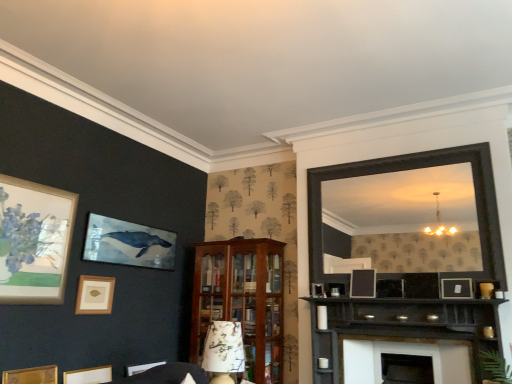
The width and height of the screenshot is (512, 384). What do you see at coordinates (242, 301) in the screenshot?
I see `wooden cabinet at center` at bounding box center [242, 301].

What do you see at coordinates (456, 288) in the screenshot? I see `matte black picture frame at upper right, acting as the first picture frame starting from the right` at bounding box center [456, 288].

What is the approximate width of matte gold picture frame at lower left, the 3th picture frame from the right?

It is 8.76 centimeters.

Where is `matte gold picture frame at lower left, the 2th picture frame in the left-to-right sequence`? This screenshot has width=512, height=384. matte gold picture frame at lower left, the 2th picture frame in the left-to-right sequence is located at coordinates pos(95,295).

The height and width of the screenshot is (384, 512). I want to click on black wooden mirror at upper right, so click(x=407, y=169).

Image resolution: width=512 pixels, height=384 pixels. Identify the location of wooden cabinet at center. (242, 301).

Can you see wooden cabinet at center touching matte gold picture frame at lower left, the 3th picture frame from the right?

No, wooden cabinet at center is not making contact with matte gold picture frame at lower left, the 3th picture frame from the right.

Is wooden cabinet at center at the right side of matte gold picture frame at lower left, the 3th picture frame from the right?

Correct, you'll find wooden cabinet at center to the right of matte gold picture frame at lower left, the 3th picture frame from the right.

Which is closer to the camera, (197, 360) or (73, 375)?

Point (197, 360) appears to be farther away from the viewer than point (73, 375).

From a real-world perspective, who is located lower, wooden cabinet at center or matte gold picture frame at lower left, positioned as the 3th picture frame in left-to-right order?

matte gold picture frame at lower left, positioned as the 3th picture frame in left-to-right order, from a real-world perspective.

Which is behind, point (8, 382) or point (99, 376)?

The point (99, 376) is farther.

Between wooden picture frame at lower left, the fifth picture frame when ordered from right to left, and matte gold picture frame at lower left, positioned as the 3th picture frame in left-to-right order, which one has larger size?

matte gold picture frame at lower left, positioned as the 3th picture frame in left-to-right order.

From the image's perspective, would you say wooden picture frame at lower left, the first picture frame from the left, is positioned over matte gold picture frame at lower left, the 3th picture frame from the right?

Correct, wooden picture frame at lower left, the first picture frame from the left, appears higher than matte gold picture frame at lower left, the 3th picture frame from the right, in the image.

Would you say wooden picture frame at lower left, the fifth picture frame when ordered from right to left, is to the left or to the right of matte gold picture frame at lower left, positioned as the 3th picture frame in left-to-right order, in the picture?

Based on their positions, wooden picture frame at lower left, the fifth picture frame when ordered from right to left, is located to the left of matte gold picture frame at lower left, positioned as the 3th picture frame in left-to-right order.

Is matte gold picture frame at lower left, acting as the 4th picture frame starting from the right, in front of matte gold picture frame at lower left, the 3th picture frame from the right?

No, it is not.

Starting from the matte gold picture frame at lower left, the 3th picture frame from the right, which picture frame is the 1st one to the left? Please provide its 2D coordinates.

[(95, 295)]

How different are the orientations of matte gold picture frame at lower left, acting as the 4th picture frame starting from the right, and matte gold picture frame at lower left, positioned as the 3th picture frame in left-to-right order, in degrees?

The angle between the facing direction of matte gold picture frame at lower left, acting as the 4th picture frame starting from the right, and the facing direction of matte gold picture frame at lower left, positioned as the 3th picture frame in left-to-right order, is 0.309 degrees.

Is matte gold picture frame at lower left, acting as the 4th picture frame starting from the right, oriented towards matte gold picture frame at lower left, positioned as the 3th picture frame in left-to-right order?

No.

Which of these two, matte black picture frame at center, which is counted as the 4th picture frame, starting from the left, or black wooden mirror at upper right, is thinner?

With smaller width is black wooden mirror at upper right.

Which point is more forward, [351,280] or [485,156]?

The point [485,156] is closer to the camera.

Which of these two, matte black picture frame at center, which appears as the second picture frame when viewed from the right, or black wooden mirror at upper right, is bigger?

black wooden mirror at upper right is bigger.

Considering the relative sizes of dark wood shelf at lower right and matte gold picture frame at lower left, the 2th picture frame in the left-to-right sequence, in the image provided, is dark wood shelf at lower right wider than matte gold picture frame at lower left, the 2th picture frame in the left-to-right sequence,?

Yes, dark wood shelf at lower right is wider than matte gold picture frame at lower left, the 2th picture frame in the left-to-right sequence.

Could you tell me if dark wood shelf at lower right is turned towards matte gold picture frame at lower left, the 2th picture frame in the left-to-right sequence?

No, dark wood shelf at lower right is not aimed at matte gold picture frame at lower left, the 2th picture frame in the left-to-right sequence.

Are dark wood shelf at lower right and matte gold picture frame at lower left, acting as the 4th picture frame starting from the right, located far from each other?

Absolutely, dark wood shelf at lower right is distant from matte gold picture frame at lower left, acting as the 4th picture frame starting from the right.

Does matte gold picture frame at lower left, the 3th picture frame from the right, appear on the left side of wooden picture frame at lower left, the fifth picture frame when ordered from right to left?

No, matte gold picture frame at lower left, the 3th picture frame from the right, is not to the left of wooden picture frame at lower left, the fifth picture frame when ordered from right to left.

Does matte gold picture frame at lower left, positioned as the 3th picture frame in left-to-right order, turn towards wooden picture frame at lower left, the first picture frame from the left?

No, matte gold picture frame at lower left, positioned as the 3th picture frame in left-to-right order, is not aimed at wooden picture frame at lower left, the first picture frame from the left.

Considering the points (104, 370) and (41, 380), which point is in front, point (104, 370) or point (41, 380)?

The point (41, 380) is closer.

At what (x,y) coordinates should I click in order to perform the action: click on the 1st picture frame above the matte gold picture frame at lower left, the 3th picture frame from the right (from the image's perspective). Please return your answer as a coordinate pair (x, y). Looking at the image, I should click on (31, 375).

Where is `shelf that appears below the matte black picture frame at center, which is counted as the 4th picture frame, starting from the left (from a real-world perspective)`? shelf that appears below the matte black picture frame at center, which is counted as the 4th picture frame, starting from the left (from a real-world perspective) is located at coordinates (400, 326).

How many degrees apart are the facing directions of dark wood shelf at lower right and matte black picture frame at center, which is counted as the 4th picture frame, starting from the left?

dark wood shelf at lower right and matte black picture frame at center, which is counted as the 4th picture frame, starting from the left, are facing 1.52 degrees away from each other.

Is dark wood shelf at lower right looking in the opposite direction of matte black picture frame at center, which is counted as the 4th picture frame, starting from the left?

dark wood shelf at lower right is not turned away from matte black picture frame at center, which is counted as the 4th picture frame, starting from the left.

Is dark wood shelf at lower right shorter than matte black picture frame at center, which is counted as the 4th picture frame, starting from the left?

No.

This screenshot has height=384, width=512. Find the location of `cabinetry positioned vertically above the matte gold picture frame at lower left, the 3th picture frame from the right (from a real-world perspective)`. cabinetry positioned vertically above the matte gold picture frame at lower left, the 3th picture frame from the right (from a real-world perspective) is located at coordinates (242, 301).

Starting from the wooden picture frame at lower left, the first picture frame from the left, which picture frame is the 1st one behind? Please provide its 2D coordinates.

[(88, 375)]

When comparing their distances from white glossy fireplace at lower center, does matte gold picture frame at lower left, the 2th picture frame in the left-to-right sequence, or wooden cabinet at center seem closer?

The object closer to white glossy fireplace at lower center is wooden cabinet at center.

Which object lies nearer to the anchor point floral-patterned fabric lampshade at center, white glossy fireplace at lower center or matte gold picture frame at lower left, the 2th picture frame in the left-to-right sequence?

matte gold picture frame at lower left, the 2th picture frame in the left-to-right sequence, is closer to floral-patterned fabric lampshade at center.

When comparing their distances from floral-patterned fabric lampshade at center, does black wooden mirror at upper right or matte gold picture frame at lower left, the 2th picture frame in the left-to-right sequence, seem closer?

matte gold picture frame at lower left, the 2th picture frame in the left-to-right sequence, is positioned closer to the anchor floral-patterned fabric lampshade at center.

When comparing their distances from matte gold picture frame at lower left, positioned as the 3th picture frame in left-to-right order, does matte gold picture frame at lower left, the 2th picture frame in the left-to-right sequence, or wooden picture frame at lower left, the fifth picture frame when ordered from right to left, seem closer?

wooden picture frame at lower left, the fifth picture frame when ordered from right to left, is closer to matte gold picture frame at lower left, positioned as the 3th picture frame in left-to-right order.

Based on the photo, considering their positions, is matte gold picture frame at lower left, positioned as the 3th picture frame in left-to-right order, positioned further to wooden cabinet at center than matte black picture frame at upper right, acting as the first picture frame starting from the right?

matte black picture frame at upper right, acting as the first picture frame starting from the right, is further to wooden cabinet at center.

Estimate the real-world distances between objects in this image. Which object is further from wooden picture frame at lower left, the fifth picture frame when ordered from right to left, white glossy fireplace at lower center or floral-patterned fabric lampshade at center?

Based on the image, white glossy fireplace at lower center appears to be further to wooden picture frame at lower left, the fifth picture frame when ordered from right to left.

Which object lies further to the anchor point dark wood shelf at lower right, floral-patterned fabric lampshade at center or matte black picture frame at center, which appears as the second picture frame when viewed from the right?

floral-patterned fabric lampshade at center is positioned further to the anchor dark wood shelf at lower right.

Looking at the image, which one is located further to wooden cabinet at center, matte gold picture frame at lower left, acting as the 4th picture frame starting from the right, or white glossy fireplace at lower center?

matte gold picture frame at lower left, acting as the 4th picture frame starting from the right.

You are a GUI agent. You are given a task and a screenshot of the screen. Output one action in this format:
    pyautogui.click(x=<x>, y=<y>)
    Task: Click on the lamp between matte gold picture frame at lower left, the 2th picture frame in the left-to-right sequence, and matte black picture frame at center, which appears as the second picture frame when viewed from the right, in the horizontal direction
    
    Given the screenshot: What is the action you would take?
    pyautogui.click(x=224, y=351)

Find the location of a particular element. This screenshot has height=384, width=512. shelf between wooden picture frame at lower left, the first picture frame from the left, and black wooden mirror at upper right is located at coordinates (400, 326).

You are a GUI agent. You are given a task and a screenshot of the screen. Output one action in this format:
    pyautogui.click(x=<x>, y=<y>)
    Task: Click on the cabinetry between matte gold picture frame at lower left, the 3th picture frame from the right, and dark wood shelf at lower right, in the horizontal direction
    This screenshot has width=512, height=384.
    Given the screenshot: What is the action you would take?
    pyautogui.click(x=242, y=301)

The height and width of the screenshot is (384, 512). Identify the location of entertainment center located between matte gold picture frame at lower left, positioned as the 3th picture frame in left-to-right order, and white glossy fireplace at lower center in the left-right direction. (407, 169).